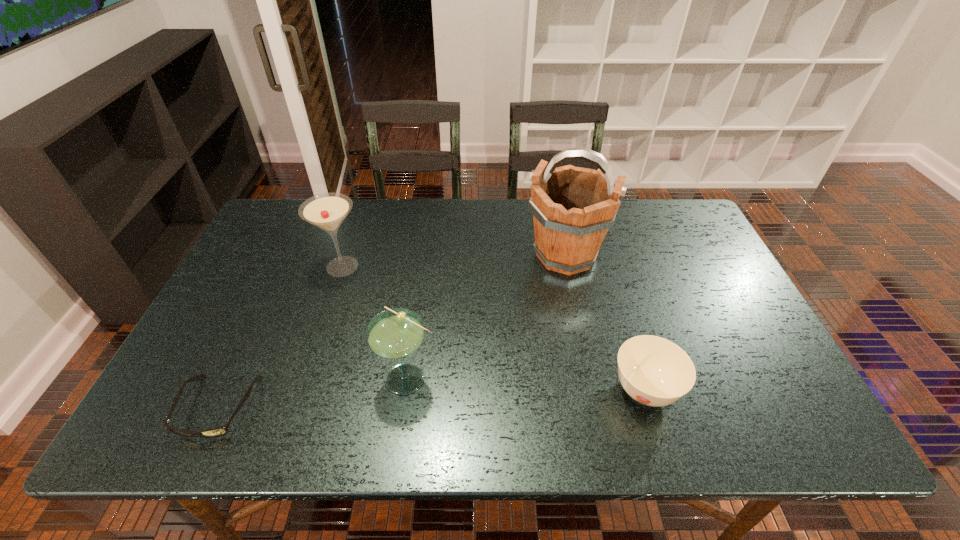
Find the location of a particular element. The image size is (960, 540). the tallest object is located at coordinates (573, 207).

This screenshot has height=540, width=960. I want to click on the second tallest object, so click(327, 211).

What are the coordinates of `the fourth object from right to left` in the screenshot? It's located at (327, 211).

Where is `the third object from right to left`? The image size is (960, 540). the third object from right to left is located at coordinates (394, 334).

You are a GUI agent. You are given a task and a screenshot of the screen. Output one action in this format:
    pyautogui.click(x=<x>, y=<y>)
    Task: Click on the nearer martini
    This screenshot has width=960, height=540.
    Given the screenshot: What is the action you would take?
    pyautogui.click(x=394, y=334)

The width and height of the screenshot is (960, 540). Find the location of `sugar bowl`. sugar bowl is located at coordinates (654, 371).

Locate an element on the screen. The height and width of the screenshot is (540, 960). the leftmost object is located at coordinates (219, 431).

This screenshot has height=540, width=960. In order to click on the shortest object in this screenshot , I will do `click(219, 431)`.

You are a GUI agent. You are given a task and a screenshot of the screen. Output one action in this format:
    pyautogui.click(x=<x>, y=<y>)
    Task: Click on the vacant space located on the left of the tallest object
    This screenshot has height=540, width=960.
    Given the screenshot: What is the action you would take?
    pyautogui.click(x=468, y=255)

Image resolution: width=960 pixels, height=540 pixels. In order to click on vacant space located on the right of the farther martini in this screenshot , I will do [493, 267].